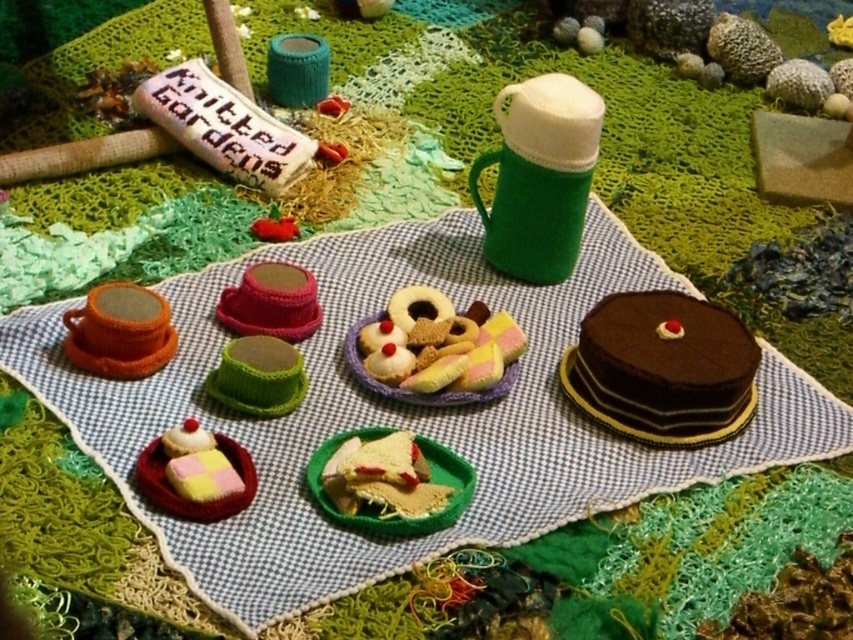
Which is below, chocolate matte cake at center or pastel felt cookies at center?

chocolate matte cake at center

What do you see at coordinates (663, 369) in the screenshot? The height and width of the screenshot is (640, 853). I see `chocolate matte cake at center` at bounding box center [663, 369].

Where is `chocolate matte cake at center`? The image size is (853, 640). chocolate matte cake at center is located at coordinates (663, 369).

Does knitted fabric picnic blanket at center have a lesser height compared to pastel felt cookies at center?

No.

Describe the element at coordinates (399, 413) in the screenshot. The image size is (853, 640). I see `knitted fabric picnic blanket at center` at that location.

In order to click on knitted fabric picnic blanket at center in this screenshot , I will do `click(399, 413)`.

Between knitted fabric picnic blanket at center and chocolate matte cake at center, which one is positioned higher?

chocolate matte cake at center is above.

Is knitted fabric picnic blanket at center to the left of chocolate matte cake at center from the viewer's perspective?

Indeed, knitted fabric picnic blanket at center is positioned on the left side of chocolate matte cake at center.

Who is more distant from viewer, [305,362] or [718,435]?

The point [305,362] is more distant.

Locate an element on the screen. knitted fabric picnic blanket at center is located at coordinates (399, 413).